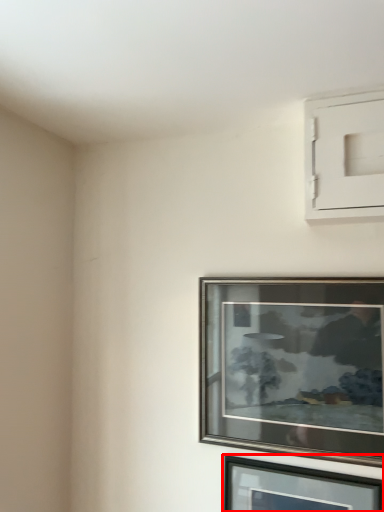
Question: From the image, what is the correct spatial relationship of picture frame (annotated by the red box) in relation to picture frame?

Choices:
 (A) left
 (B) right

Answer: (B)